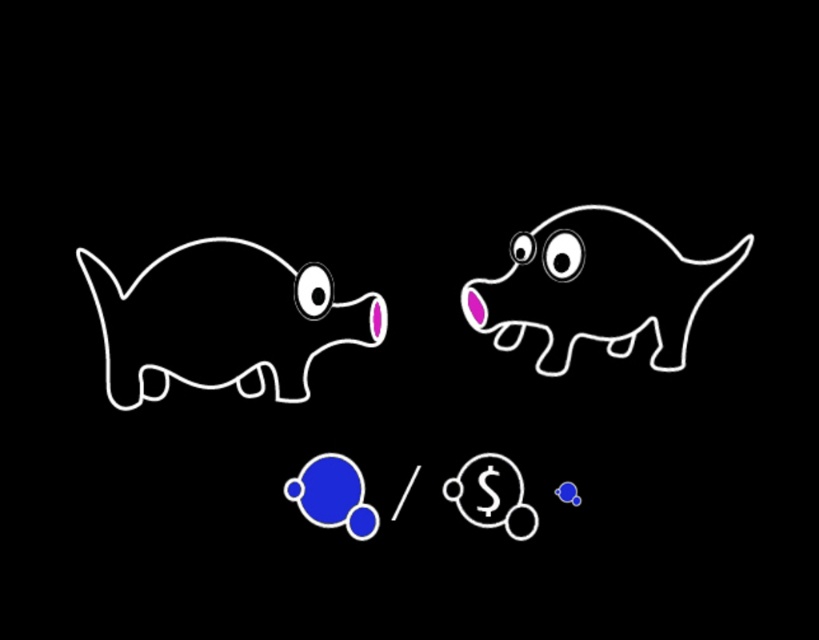
You are a painter standing in front of the image. You want to paint a new object between the white outline dog at center and the transparent glass bubble at upper center. Which object should you place closer to the bottom to avoid overlapping?

The white outline dog at center is much taller than the transparent glass bubble at upper center, so you should place the new object closer to the bottom near the white outline dog at center to avoid overlapping.

You are an artist who wants to draw both the white outline dog at center and the white glossy dog at upper right. Which one should you draw first if you want to start with the larger one?

You should start with the white outline dog at center because it is bigger than the white glossy dog at upper right.

You are trying to determine which object is wider between the pink matte piggy bank at left and the white glossy bubble at upper left. Based on the scene description, which one has a greater width?

The pink matte piggy bank at left has a greater width than the white glossy bubble at upper left according to the description.